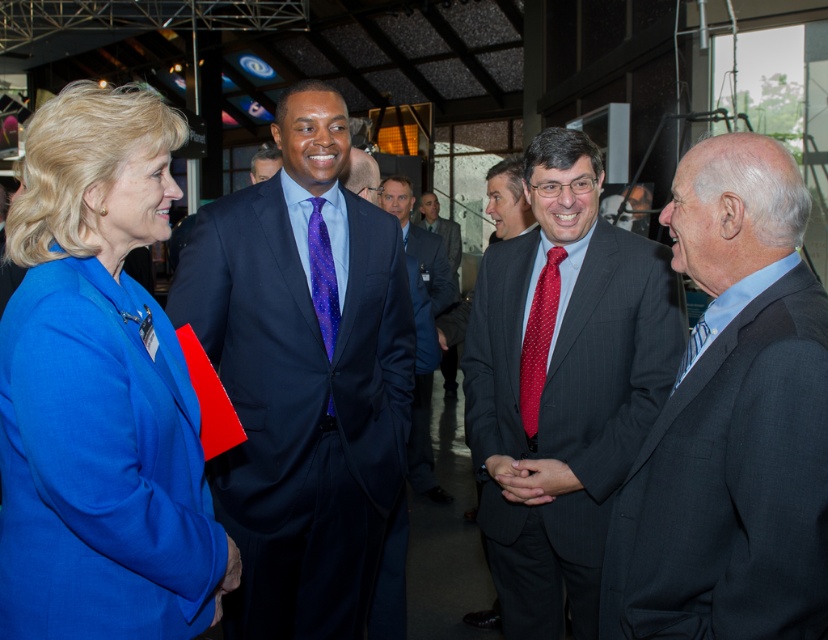
Is matte blue suit at center to the left of dark blue suit at center from the viewer's perspective?

Indeed, matte blue suit at center is positioned on the left side of dark blue suit at center.

Between matte blue suit at center and dark blue suit at center, which one has more height?

Standing taller between the two is matte blue suit at center.

Describe the element at coordinates (302, 376) in the screenshot. I see `matte blue suit at center` at that location.

The image size is (828, 640). In order to click on matte blue suit at center in this screenshot , I will do `click(302, 376)`.

Can you confirm if dark gray pinstripe suit at center is shorter than purple dotted fabric tie at center?

Incorrect, dark gray pinstripe suit at center's height does not fall short of purple dotted fabric tie at center's.

The width and height of the screenshot is (828, 640). I want to click on dark gray pinstripe suit at center, so click(562, 385).

The width and height of the screenshot is (828, 640). I want to click on dark gray pinstripe suit at center, so click(562, 385).

Where is `dark gray pinstripe suit at center`? dark gray pinstripe suit at center is located at coordinates (562, 385).

The image size is (828, 640). What do you see at coordinates (99, 390) in the screenshot?
I see `matte blue blazer at center` at bounding box center [99, 390].

Is matte blue blazer at center above dark blue suit at center?

Indeed, matte blue blazer at center is positioned over dark blue suit at center.

Is point (166, 321) positioned in front of point (429, 300)?

Yes, it is.

This screenshot has width=828, height=640. Find the location of `matte blue blazer at center`. matte blue blazer at center is located at coordinates (99, 390).